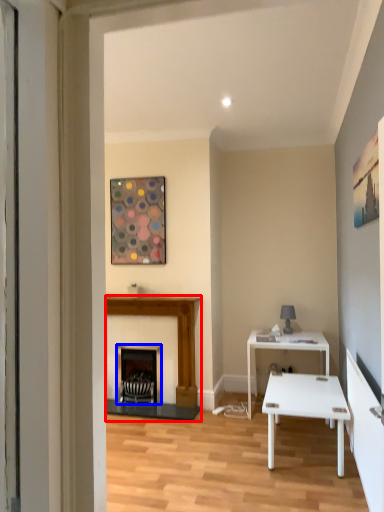
Question: Which object is closer to the camera taking this photo, fireplace (highlighted by a red box) or fireplace (highlighted by a blue box)?

Choices:
 (A) fireplace
 (B) fireplace

Answer: (A)